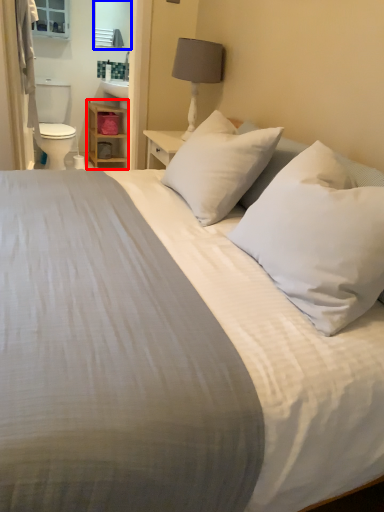
Question: Which point is further to the camera, dresser (highlighted by a red box) or mirror (highlighted by a blue box)?

Choices:
 (A) dresser
 (B) mirror

Answer: (A)